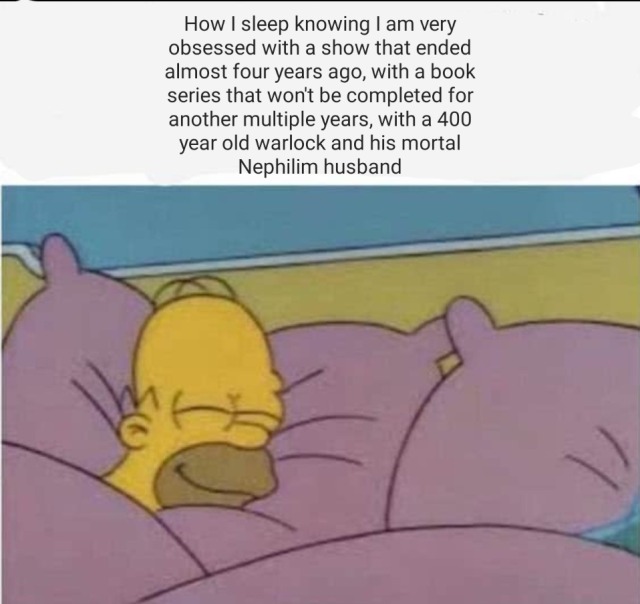
Image resolution: width=640 pixels, height=604 pixels. Find the location of `blue wall`. blue wall is located at coordinates (145, 228).